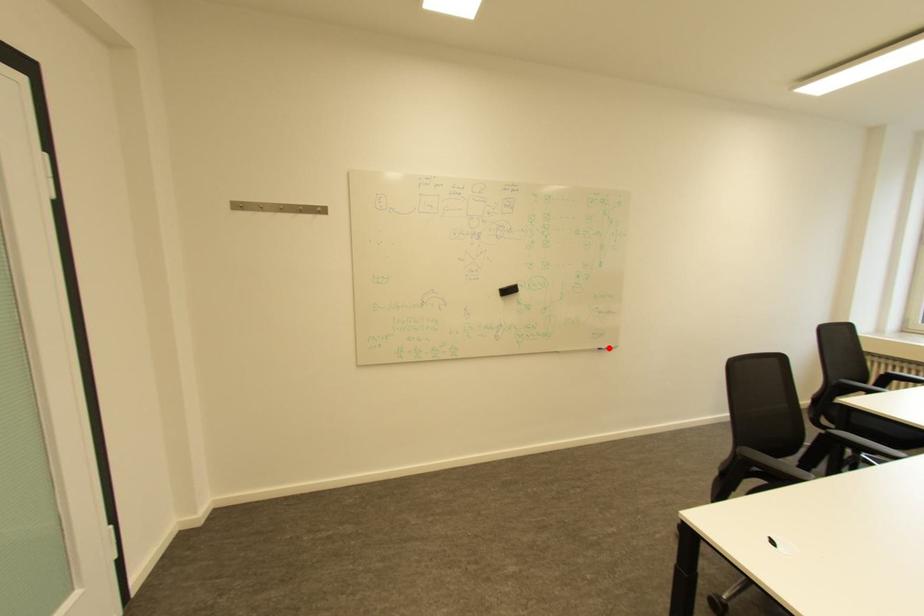
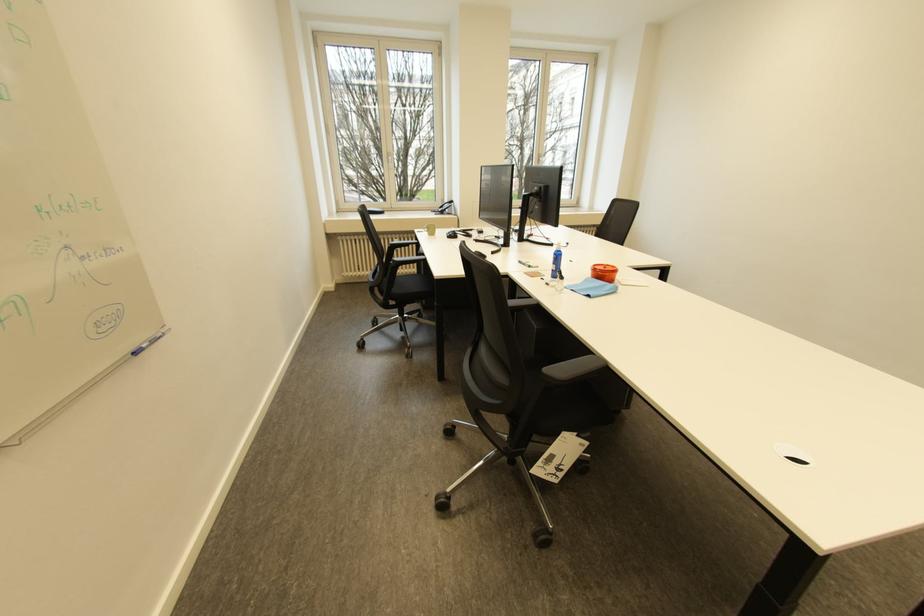
Question: A red point is marked in image1. In image2, is the corresponding 3D point closer to the camera or farther? Reply with the corresponding letter.

Choices:
 (A) The corresponding 3D point is closer.
 (B) The corresponding 3D point is farther.

Answer: (A)